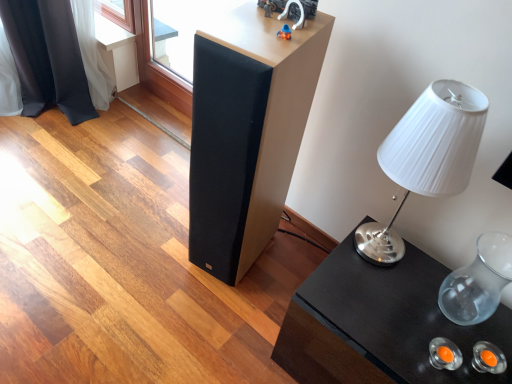
At what (x,y) coordinates should I click in order to perform the action: click on matte black speaker at center. Please return your answer as a coordinate pair (x, y). Looking at the image, I should click on (247, 133).

What do you see at coordinates (379, 324) in the screenshot? I see `black glossy table at lower right` at bounding box center [379, 324].

The height and width of the screenshot is (384, 512). Find the location of `transparent glass vase at right`. transparent glass vase at right is located at coordinates (478, 282).

Find the location of `furniture on the left of the white pleated fabric lampshade at right`. furniture on the left of the white pleated fabric lampshade at right is located at coordinates (247, 133).

What's the angular difference between matte black speaker at center and white pleated fabric lampshade at right's facing directions?

They differ by 14.3 degrees in their facing directions.

From the image's perspective, between matte black speaker at center and white pleated fabric lampshade at right, which one is located above?

matte black speaker at center is shown above in the image.

Which object is closer to the camera, matte black speaker at center or white pleated fabric lampshade at right?

Positioned in front is white pleated fabric lampshade at right.

Considering the sizes of objects black glossy table at lower right and white pleated fabric lampshade at right in the image provided, who is thinner, black glossy table at lower right or white pleated fabric lampshade at right?

Thinner between the two is white pleated fabric lampshade at right.

How different are the orientations of black glossy table at lower right and white pleated fabric lampshade at right in degrees?

The angular difference between black glossy table at lower right and white pleated fabric lampshade at right is 3.62 degrees.

The height and width of the screenshot is (384, 512). Identify the location of table below the white pleated fabric lampshade at right (from the image's perspective). (379, 324).

Which of these two, matte black speaker at center or black glossy table at lower right, stands taller?

matte black speaker at center.

Is matte black speaker at center turned away from black glossy table at lower right?

matte black speaker at center is not turned away from black glossy table at lower right.

Is matte black speaker at center inside the boundaries of black glossy table at lower right, or outside?

matte black speaker at center is spatially situated outside black glossy table at lower right.

Does point (475, 286) lie behind point (261, 159)?

Yes, point (475, 286) is farther from viewer.

From a real-world perspective, does transparent glass vase at right sit lower than matte black speaker at center?

Indeed, from a real-world perspective, transparent glass vase at right is positioned beneath matte black speaker at center.

Is the surface of transparent glass vase at right in direct contact with matte black speaker at center?

No, transparent glass vase at right is not with matte black speaker at center.

Locate an element on the screen. furniture on the left of transparent glass vase at right is located at coordinates (247, 133).

From a real-world perspective, is white pleated fabric lampshade at right located beneath black glossy table at lower right?

Actually, white pleated fabric lampshade at right is physically above black glossy table at lower right in the real world.

Which of these two, white pleated fabric lampshade at right or black glossy table at lower right, is thinner?

white pleated fabric lampshade at right.

Considering the points (439, 186) and (322, 279), which point is in front, point (439, 186) or point (322, 279)?

The point (439, 186) is closer.

How different are the orientations of white pleated fabric lampshade at right and black glossy table at lower right in degrees?

The facing directions of white pleated fabric lampshade at right and black glossy table at lower right are 3.62 degrees apart.

Image resolution: width=512 pixels, height=384 pixels. Find the location of `glass vase behind the matte black speaker at center`. glass vase behind the matte black speaker at center is located at coordinates (478, 282).

How different are the orientations of matte black speaker at center and transparent glass vase at right in degrees?

12.2 degrees separate the facing orientations of matte black speaker at center and transparent glass vase at right.

Would you consider matte black speaker at center to be distant from transparent glass vase at right?

No, matte black speaker at center is not far from transparent glass vase at right.

Is matte black speaker at center inside or outside of transparent glass vase at right?

matte black speaker at center lies outside transparent glass vase at right.

Considering the positions of point (468, 344) and point (215, 137), is point (468, 344) closer or farther from the camera than point (215, 137)?

Point (468, 344) is positioned closer to the camera compared to point (215, 137).

Is black glossy table at lower right taller than matte black speaker at center?

Incorrect, the height of black glossy table at lower right is not larger of that of matte black speaker at center.

Is black glossy table at lower right at the right side of matte black speaker at center?

Yes.

From a real-world perspective, is black glossy table at lower right physically located above or below matte black speaker at center?

Clearly, from a real-world perspective, black glossy table at lower right is below matte black speaker at center.

The width and height of the screenshot is (512, 384). In the image, there is a white pleated fabric lampshade at right. Find the location of `furniture above it (from the image's perspective)`. furniture above it (from the image's perspective) is located at coordinates (247, 133).

The image size is (512, 384). What are the coordinates of `table below the white pleated fabric lampshade at right (from the image's perspective)` in the screenshot? It's located at (379, 324).

When comparing their distances from black glossy table at lower right, does matte black speaker at center or white pleated fabric lampshade at right seem further?

The object further to black glossy table at lower right is matte black speaker at center.

Looking at the image, which one is located closer to black glossy table at lower right, white pleated fabric lampshade at right or transparent glass vase at right?

Among the two, transparent glass vase at right is located nearer to black glossy table at lower right.

Considering their positions, is matte black speaker at center positioned further to white pleated fabric lampshade at right than transparent glass vase at right?

transparent glass vase at right is further to white pleated fabric lampshade at right.

In the scene shown: Estimate the real-world distances between objects in this image. Which object is closer to transparent glass vase at right, black glossy table at lower right or white pleated fabric lampshade at right?

The object closer to transparent glass vase at right is black glossy table at lower right.

Estimate the real-world distances between objects in this image. Which object is closer to transparent glass vase at right, white pleated fabric lampshade at right or matte black speaker at center?

Based on the image, white pleated fabric lampshade at right appears to be nearer to transparent glass vase at right.

Based on their spatial positions, is black glossy table at lower right or transparent glass vase at right closer to matte black speaker at center?

Among the two, black glossy table at lower right is located nearer to matte black speaker at center.

Considering their positions, is black glossy table at lower right positioned closer to transparent glass vase at right than matte black speaker at center?

black glossy table at lower right is positioned closer to the anchor transparent glass vase at right.

When comparing their distances from white pleated fabric lampshade at right, does black glossy table at lower right or matte black speaker at center seem further?

matte black speaker at center lies further to white pleated fabric lampshade at right than the other object.

Identify the location of lamp situated between matte black speaker at center and transparent glass vase at right from left to right. Image resolution: width=512 pixels, height=384 pixels. (426, 157).

Where is `glass vase between white pleated fabric lampshade at right and black glossy table at lower right from top to bottom`? This screenshot has width=512, height=384. glass vase between white pleated fabric lampshade at right and black glossy table at lower right from top to bottom is located at coordinates (478, 282).

The height and width of the screenshot is (384, 512). Find the location of `table between matte black speaker at center and transparent glass vase at right in the horizontal direction`. table between matte black speaker at center and transparent glass vase at right in the horizontal direction is located at coordinates (379, 324).

The width and height of the screenshot is (512, 384). What are the coordinates of `lamp that lies between matte black speaker at center and black glossy table at lower right from top to bottom` in the screenshot? It's located at (426, 157).